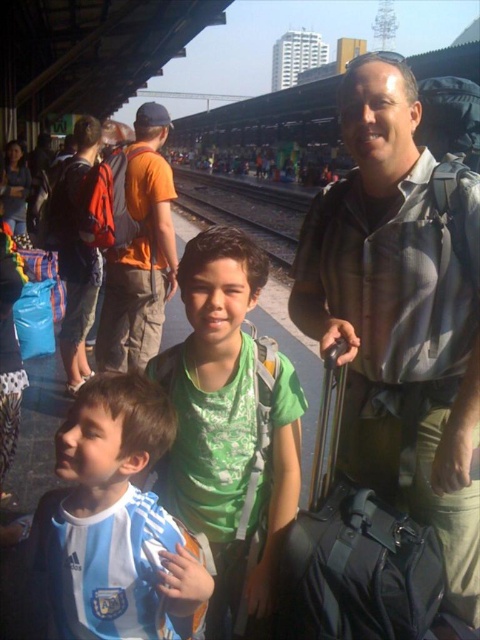
You are a photographer trying to capture a photo of the black fabric suitcase at center without including the green matte shirt at center in the frame. Based on their positions, is this possible?

The green matte shirt at center is to the left of the black fabric suitcase at center, so if you position yourself to the right side of the suitcase, you can capture the suitcase without the shirt in the frame.

You are a delivery robot with a 12 inch wide package that needs to be placed between the green matte shirt at center and the black fabric suitcase at center. Can the package fit in the space between them?

The distance between the green matte shirt at center and the black fabric suitcase at center is 10.58 inches. Since the package is 12 inches wide, it cannot fit in the space between them.